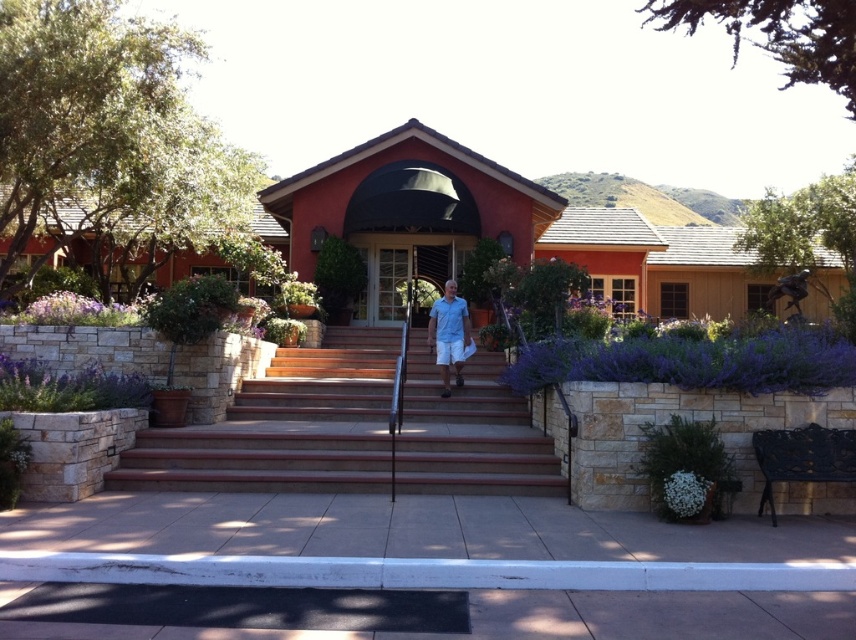
Question: Which point is closer to the camera?

Choices:
 (A) (706, 468)
 (B) (134, 307)
 (C) (170, 294)

Answer: (A)

Question: Does brown wooden stairs at center lie behind green leafy plant at lower right?

Choices:
 (A) no
 (B) yes

Answer: (B)

Question: Estimate the real-world distances between objects in this image. Which object is farther from the white fluffy flower at lower right?

Choices:
 (A) purple matte flower at lower left
 (B) green leafy plant at lower right
 (C) purple leafy bush at right
 (D) green leafy bush at lower left

Answer: (A)

Question: Is brown wooden stairs at center above green leafy bush at lower left?

Choices:
 (A) yes
 (B) no

Answer: (B)

Question: Can you confirm if green leafy plant at lower right is wider than light blue fabric shirt at center?

Choices:
 (A) no
 (B) yes

Answer: (B)

Question: Which point is farther to the camera?

Choices:
 (A) light blue fabric shirt at center
 (B) purple leafy bush at right
 (C) green leafy bush at left

Answer: (A)